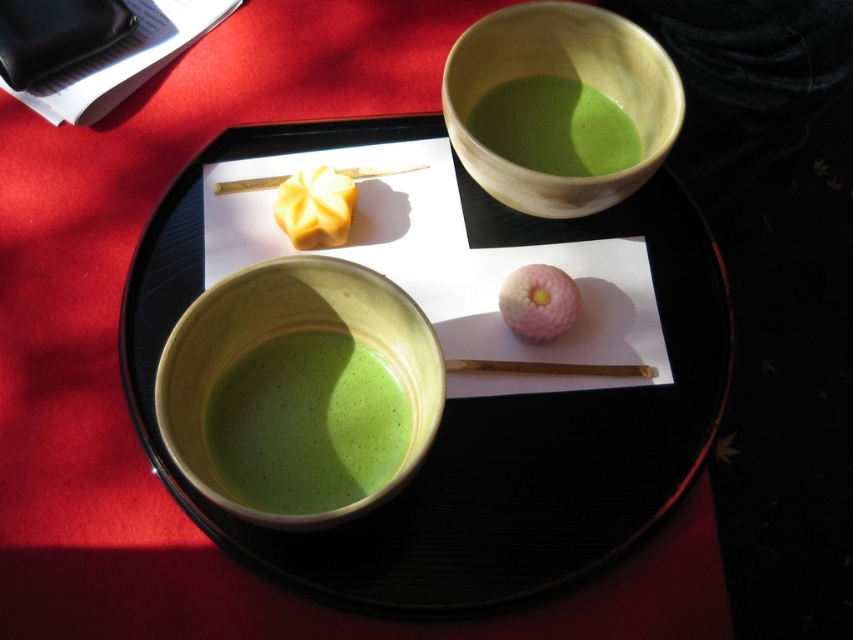
Based on the photo, you are a guest at a Japanese tea ceremony. You see the green matte bowl at upper center and the pink fluffy donut at center. Which object is positioned higher on the tray?

The green matte bowl at upper center is located above the pink fluffy donut at center, so it is positioned higher on the tray.

You are preparing for a Japanese tea ceremony and need to ensure the green matte soup at center and the yellow creamy pastry at upper left are appropriately sized. Based on the setup, which object is larger?

The green matte soup at center is bigger than the yellow creamy pastry at upper left, so the green matte soup at center is larger.